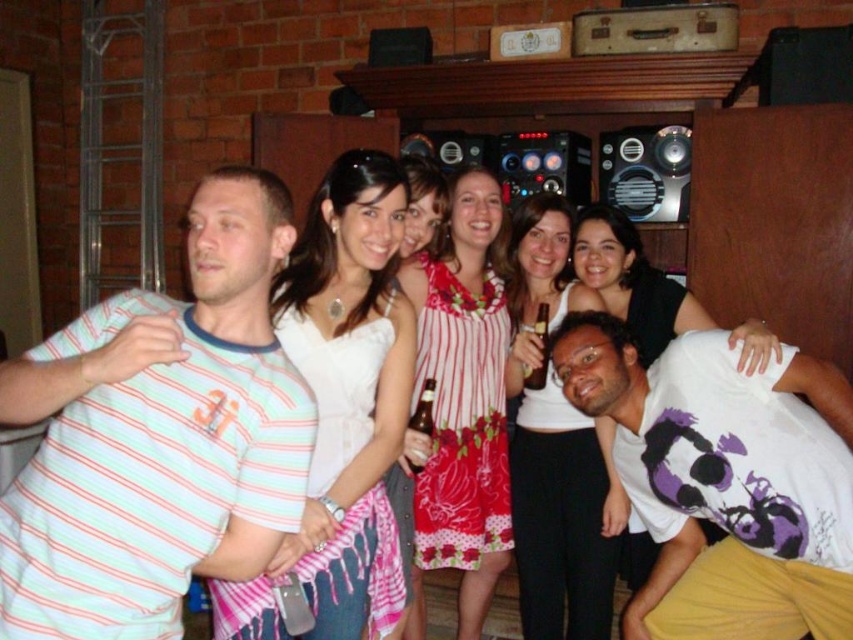
Who is more forward, (833, 637) or (682, 161)?

Point (833, 637) is in front.

Who is higher up, white matte t-shirt at center or metallic silver speaker at upper center?

metallic silver speaker at upper center is higher up.

The width and height of the screenshot is (853, 640). Identify the location of white matte t-shirt at center. (724, 481).

Locate an element on the screen. The width and height of the screenshot is (853, 640). white matte t-shirt at center is located at coordinates (724, 481).

Does point (379, 348) come behind point (399, 490)?

No, it is in front of (399, 490).

Find the location of a particular element. Image resolution: width=853 pixels, height=640 pixels. white satin dress at center is located at coordinates (341, 410).

This screenshot has height=640, width=853. I want to click on white satin dress at center, so click(x=341, y=410).

Locate an element on the screen. white satin dress at center is located at coordinates (341, 410).

Who is taller, white matte t-shirt at center or shiny black speaker at upper center?

white matte t-shirt at center

Which is below, white matte t-shirt at center or shiny black speaker at upper center?

white matte t-shirt at center

Which is in front, point (795, 474) or point (556, 170)?

Point (795, 474) is in front.

The image size is (853, 640). I want to click on white matte t-shirt at center, so click(724, 481).